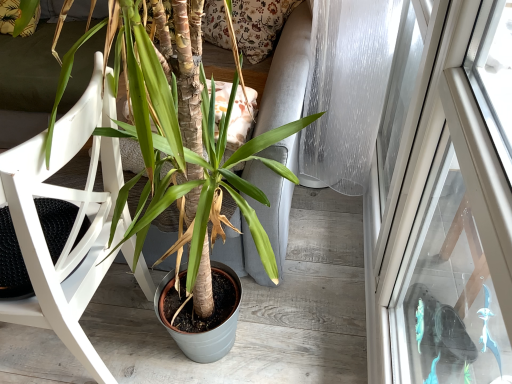
Question: From the image's perspective, would you say white wood chair at left is shown under matte brown pot at center?

Choices:
 (A) yes
 (B) no

Answer: (A)

Question: Is white wood chair at left looking in the opposite direction of matte brown pot at center?

Choices:
 (A) no
 (B) yes

Answer: (B)

Question: Does white wood chair at left have a greater width compared to matte brown pot at center?

Choices:
 (A) yes
 (B) no

Answer: (B)

Question: From a real-world perspective, is white wood chair at left on top of matte brown pot at center?

Choices:
 (A) no
 (B) yes

Answer: (A)

Question: Is matte brown pot at center a part of white wood chair at left?

Choices:
 (A) no
 (B) yes

Answer: (A)

Question: Considering the relative positions of white wood chair at left and matte brown pot at center in the image provided, is white wood chair at left to the right of matte brown pot at center from the viewer's perspective?

Choices:
 (A) yes
 (B) no

Answer: (B)

Question: Considering the relative sizes of matte brown pot at center and white wood chair at left in the image provided, is matte brown pot at center shorter than white wood chair at left?

Choices:
 (A) no
 (B) yes

Answer: (A)

Question: Can you confirm if matte brown pot at center is thinner than white wood chair at left?

Choices:
 (A) yes
 (B) no

Answer: (B)

Question: Is matte brown pot at center placed right next to white wood chair at left?

Choices:
 (A) no
 (B) yes

Answer: (B)

Question: Is matte brown pot at center facing away from white wood chair at left?

Choices:
 (A) no
 (B) yes

Answer: (B)

Question: Is matte brown pot at center at the left side of white wood chair at left?

Choices:
 (A) no
 (B) yes

Answer: (A)

Question: Can you confirm if matte brown pot at center is positioned to the right of white wood chair at left?

Choices:
 (A) yes
 (B) no

Answer: (A)

Question: Is white wood chair at left taller or shorter than matte brown pot at center?

Choices:
 (A) short
 (B) tall

Answer: (A)